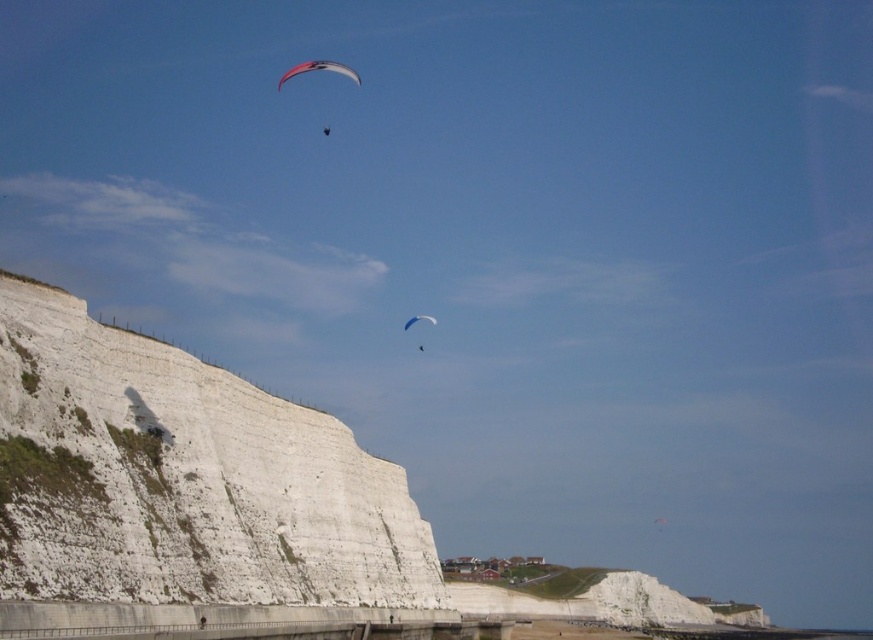
Question: Estimate the real-world distances between objects in this image. Which object is closer to the white matte parachute at upper center?

Choices:
 (A) matte pink parachute at upper center
 (B) white smooth cliff at left

Answer: (A)

Question: Is white smooth cliff at left to the right of white matte parachute at upper center from the viewer's perspective?

Choices:
 (A) no
 (B) yes

Answer: (A)

Question: Estimate the real-world distances between objects in this image. Which object is closer to the white matte parachute at upper center?

Choices:
 (A) white smooth cliff at left
 (B) matte pink parachute at upper center

Answer: (B)

Question: Among these points, which one is farthest from the camera?

Choices:
 (A) (344, 512)
 (B) (430, 320)
 (C) (322, 65)

Answer: (C)

Question: Does white smooth cliff at left have a larger size compared to matte pink parachute at upper center?

Choices:
 (A) yes
 (B) no

Answer: (A)

Question: Can you confirm if matte pink parachute at upper center is bigger than white matte parachute at upper center?

Choices:
 (A) yes
 (B) no

Answer: (A)